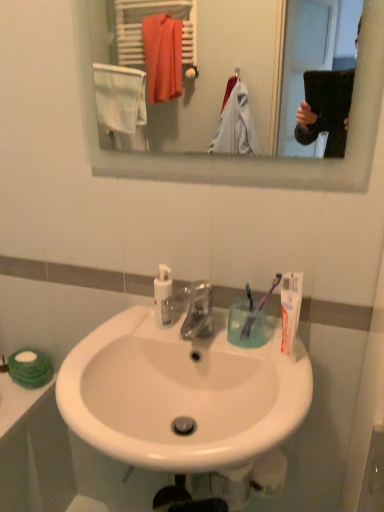
Based on the photo, measure the distance between point (x=247, y=310) and camera.

A distance of 1.06 meters exists between point (x=247, y=310) and camera.

What do you see at coordinates (258, 308) in the screenshot? I see `purple plastic toothbrush at right, marked as the first toothbrush in a right-to-left arrangement` at bounding box center [258, 308].

At what (x,y) coordinates should I click in order to perform the action: click on white glossy sink at center. Please return your answer as a coordinate pair (x, y). Looking at the image, I should click on (181, 394).

Measure the distance between point [165,276] and camera.

The distance of point [165,276] from camera is 3.58 feet.

In order to face white plastic pump bottle at center, should I rotate leftwards or rightwards?

You should rotate left by 4.162 degrees.

Image resolution: width=384 pixels, height=512 pixels. What do you see at coordinates (248, 316) in the screenshot?
I see `purple plastic toothbrush at right, the second toothbrush in the right-to-left sequence` at bounding box center [248, 316].

Find the location of a particular element. This screenshot has height=512, width=384. translucent plastic cup at sink is located at coordinates (246, 326).

Considering the positions of objects translucent plastic cup at sink and white glossy sink at center in the image provided, who is more to the right, translucent plastic cup at sink or white glossy sink at center?

translucent plastic cup at sink.

Image resolution: width=384 pixels, height=512 pixels. What are the coordinates of `coffee cup above the white glossy sink at center (from the image's perspective)` in the screenshot? It's located at (246, 326).

Is translucent plastic cup at sink completely or partially outside of white glossy sink at center?

That's correct, translucent plastic cup at sink is outside of white glossy sink at center.

Considering the sizes of objects translucent plastic cup at sink and white glossy sink at center in the image provided, who is taller, translucent plastic cup at sink or white glossy sink at center?

white glossy sink at center.

Who is bigger, translucent plastic cup at sink or purple plastic toothbrush at right, the second toothbrush in the right-to-left sequence?

Bigger between the two is translucent plastic cup at sink.

Is translucent plastic cup at sink positioned before purple plastic toothbrush at right, the second toothbrush in the right-to-left sequence?

Yes, translucent plastic cup at sink is closer to the camera.

Is point (245, 323) less distant than point (249, 320)?

No, it is behind (249, 320).

Can you tell me how much clear plastic faucet at center and white plastic pump bottle at center differ in facing direction?

The angular difference between clear plastic faucet at center and white plastic pump bottle at center is 1.52 degrees.

Is clear plastic faucet at center smaller than white plastic pump bottle at center?

No, clear plastic faucet at center is not smaller than white plastic pump bottle at center.

From the image's perspective, which one is positioned higher, clear plastic faucet at center or white plastic pump bottle at center?

white plastic pump bottle at center is shown above in the image.

From their relative heights in the image, would you say clear plastic faucet at center is taller or shorter than white plastic pump bottle at center?

Considering their sizes, clear plastic faucet at center has less height than white plastic pump bottle at center.

Is purple plastic toothbrush at right, acting as the 2th toothbrush starting from the left, inside translucent plastic cup at sink?

Yes, translucent plastic cup at sink contains purple plastic toothbrush at right, acting as the 2th toothbrush starting from the left.

Can you confirm if translucent plastic cup at sink is thinner than purple plastic toothbrush at right, marked as the first toothbrush in a right-to-left arrangement?

No.

Is translucent plastic cup at sink taller than purple plastic toothbrush at right, marked as the first toothbrush in a right-to-left arrangement?

In fact, translucent plastic cup at sink may be shorter than purple plastic toothbrush at right, marked as the first toothbrush in a right-to-left arrangement.

What's the angular difference between translucent plastic cup at sink and purple plastic toothbrush at right, marked as the first toothbrush in a right-to-left arrangement,'s facing directions?

The angular difference between translucent plastic cup at sink and purple plastic toothbrush at right, marked as the first toothbrush in a right-to-left arrangement, is 7.4e-05 degrees.

Between purple plastic toothbrush at right, positioned as the 1th toothbrush in left-to-right order, and white matte tube of toothpaste at right, which one appears on the right side from the viewer's perspective?

From the viewer's perspective, white matte tube of toothpaste at right appears more on the right side.

You are a GUI agent. You are given a task and a screenshot of the screen. Output one action in this format:
    pyautogui.click(x=<x>, y=<y>)
    Task: Click on the 2nd toothbrush below the white matte tube of toothpaste at right (from a real-world perspective)
    The image size is (384, 512).
    Given the screenshot: What is the action you would take?
    pyautogui.click(x=248, y=316)

Based on the photo, could you tell me if purple plastic toothbrush at right, the second toothbrush in the right-to-left sequence, is turned towards white matte tube of toothpaste at right?

No, purple plastic toothbrush at right, the second toothbrush in the right-to-left sequence, does not turn towards white matte tube of toothpaste at right.

Looking at this image, is purple plastic toothbrush at right, positioned as the 1th toothbrush in left-to-right order, inside or outside of white matte tube of toothpaste at right?

The correct answer is: outside.

From a real-world perspective, is clear plastic faucet at center below purple plastic toothbrush at right, the second toothbrush in the right-to-left sequence?

Yes, from a real-world perspective, clear plastic faucet at center is under purple plastic toothbrush at right, the second toothbrush in the right-to-left sequence.

Considering the sizes of objects clear plastic faucet at center and purple plastic toothbrush at right, positioned as the 1th toothbrush in left-to-right order, in the image provided, who is smaller, clear plastic faucet at center or purple plastic toothbrush at right, positioned as the 1th toothbrush in left-to-right order,?

purple plastic toothbrush at right, positioned as the 1th toothbrush in left-to-right order, is smaller.

Which object is further away from the camera, clear plastic faucet at center or purple plastic toothbrush at right, positioned as the 1th toothbrush in left-to-right order?

purple plastic toothbrush at right, positioned as the 1th toothbrush in left-to-right order, is further from the camera.

Considering the relative positions of translucent plastic cup at sink and clear plastic faucet at center in the image provided, is translucent plastic cup at sink to the left or to the right of clear plastic faucet at center?

translucent plastic cup at sink is positioned on clear plastic faucet at center's right side.

Can you see translucent plastic cup at sink touching clear plastic faucet at center?

No, translucent plastic cup at sink is not in contact with clear plastic faucet at center.

Is translucent plastic cup at sink wider or thinner than clear plastic faucet at center?

Clearly, translucent plastic cup at sink has less width compared to clear plastic faucet at center.

From the image's perspective, is translucent plastic cup at sink located above clear plastic faucet at center?

No.

What are the coordinates of `sink below the translucent plastic cup at sink (from a real-world perspective)` in the screenshot? It's located at (181, 394).

At what (x,y) coordinates should I click in order to perform the action: click on toothbrush on the left of translucent plastic cup at sink. Please return your answer as a coordinate pair (x, y). Looking at the image, I should click on tap(248, 316).

Which object lies further to the anchor point white glossy sink at center, purple plastic toothbrush at right, acting as the 2th toothbrush starting from the left, or translucent plastic cup at sink?

purple plastic toothbrush at right, acting as the 2th toothbrush starting from the left, is positioned further to the anchor white glossy sink at center.

When comparing their distances from white glossy sink at center, does clear glass mirror at upper center or clear plastic faucet at center seem closer?

The object closer to white glossy sink at center is clear plastic faucet at center.

Based on their spatial positions, is translucent plastic cup at sink or white plastic pump bottle at center further from clear plastic faucet at center?

translucent plastic cup at sink is further to clear plastic faucet at center.

Looking at the image, which one is located further to white matte tube of toothpaste at right, purple plastic toothbrush at right, acting as the 2th toothbrush starting from the left, or purple plastic toothbrush at right, the second toothbrush in the right-to-left sequence?

Based on the image, purple plastic toothbrush at right, the second toothbrush in the right-to-left sequence, appears to be further to white matte tube of toothpaste at right.

Which object lies further to the anchor point white plastic pump bottle at center, purple plastic toothbrush at right, positioned as the 1th toothbrush in left-to-right order, or white matte tube of toothpaste at right?

white matte tube of toothpaste at right is further to white plastic pump bottle at center.

Which object lies nearer to the anchor point clear glass mirror at upper center, purple plastic toothbrush at right, positioned as the 1th toothbrush in left-to-right order, or white plastic pump bottle at center?

white plastic pump bottle at center is positioned closer to the anchor clear glass mirror at upper center.

From the image, which object appears to be farther from clear glass mirror at upper center, white matte tube of toothpaste at right or translucent plastic cup at sink?

The object further to clear glass mirror at upper center is white matte tube of toothpaste at right.

Looking at this image, based on their spatial positions, is translucent plastic cup at sink or purple plastic toothbrush at right, the second toothbrush in the right-to-left sequence, closer to purple plastic toothbrush at right, acting as the 2th toothbrush starting from the left?

Based on the image, purple plastic toothbrush at right, the second toothbrush in the right-to-left sequence, appears to be nearer to purple plastic toothbrush at right, acting as the 2th toothbrush starting from the left.

What are the coordinates of `faucet positioned between white glossy sink at center and purple plastic toothbrush at right, positioned as the 1th toothbrush in left-to-right order, from near to far` in the screenshot? It's located at (191, 309).

Where is `coffee cup between clear glass mirror at upper center and white glossy sink at center in the vertical direction`? coffee cup between clear glass mirror at upper center and white glossy sink at center in the vertical direction is located at coordinates (246, 326).

Find the location of `toothpaste between white glossy sink at center and translucent plastic cup at sink in the front-back direction`. toothpaste between white glossy sink at center and translucent plastic cup at sink in the front-back direction is located at coordinates (290, 308).

In order to click on toothpaste between clear glass mirror at upper center and purple plastic toothbrush at right, the second toothbrush in the right-to-left sequence, in the up-down direction in this screenshot , I will do `click(290, 308)`.